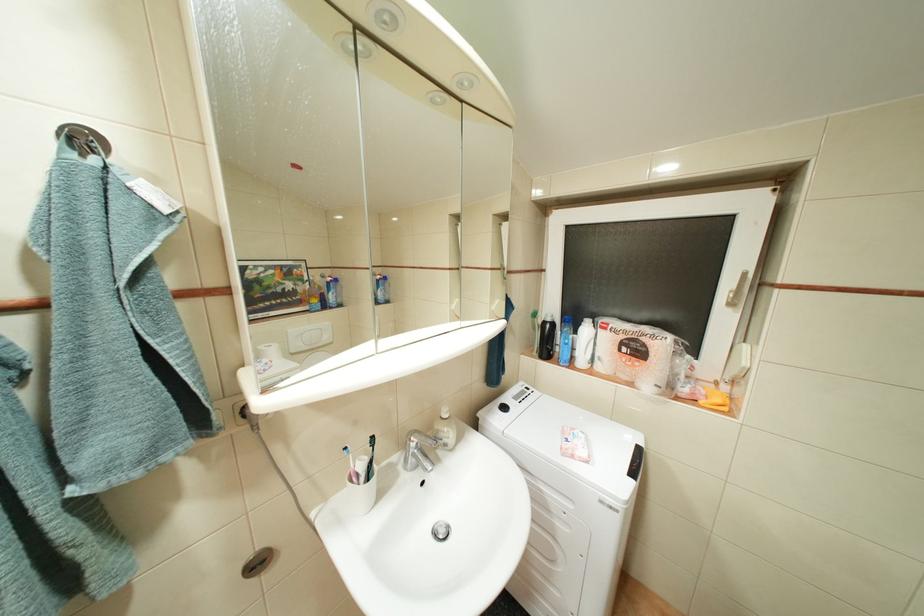
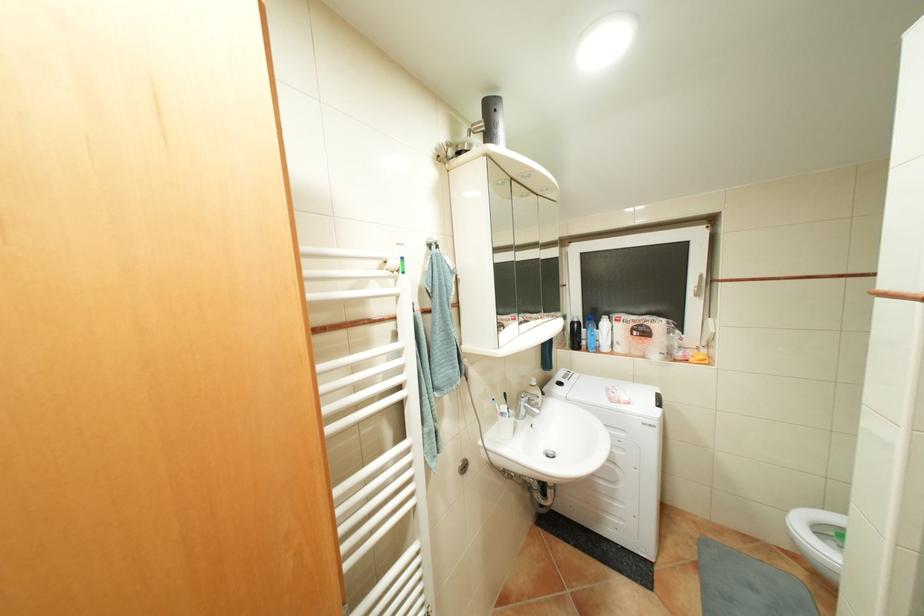
In the second image, find the point that corresponds to the point at 671,342 in the first image.

(667, 323)